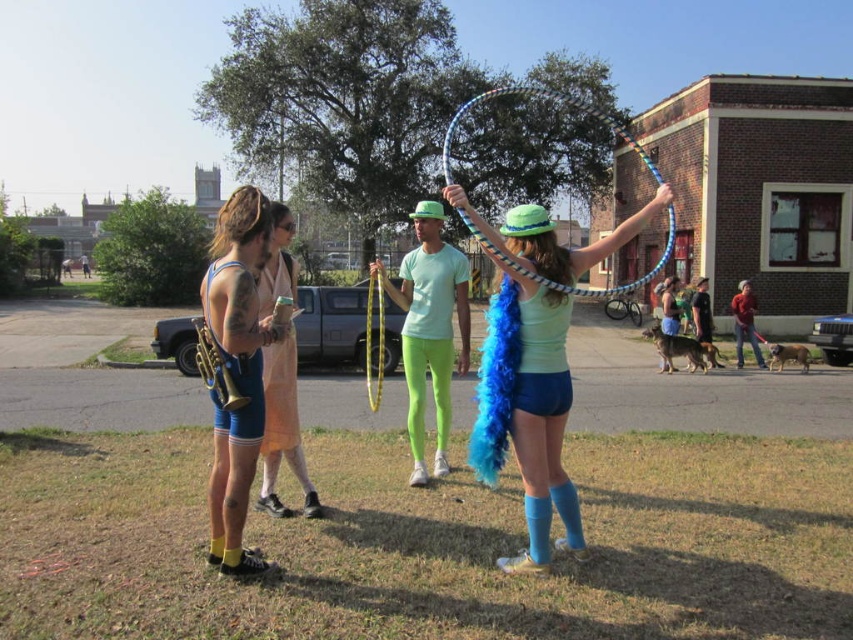
Question: Is blue feather boa at center positioned behind neon green leggings at center?

Choices:
 (A) no
 (B) yes

Answer: (A)

Question: Which point is closer to the camera?

Choices:
 (A) multicolored plastic hula hoop at center
 (B) blue feather boa at center
 (C) matte blue shorts at center
 (D) red fabric jacket at center

Answer: (B)

Question: Which is nearer to the red fabric jacket at center?

Choices:
 (A) matte blue feather boa at center
 (B) matte blue shorts at center

Answer: (B)

Question: Does matte blue shorts at center appear on the left side of multicolored plastic hula hoop at center?

Choices:
 (A) no
 (B) yes

Answer: (B)

Question: Which point is farther to the camera?

Choices:
 (A) (238, 566)
 (B) (419, 312)
 (C) (734, 333)

Answer: (C)

Question: Does matte blue feather boa at center have a larger size compared to matte blue shorts at center?

Choices:
 (A) no
 (B) yes

Answer: (A)